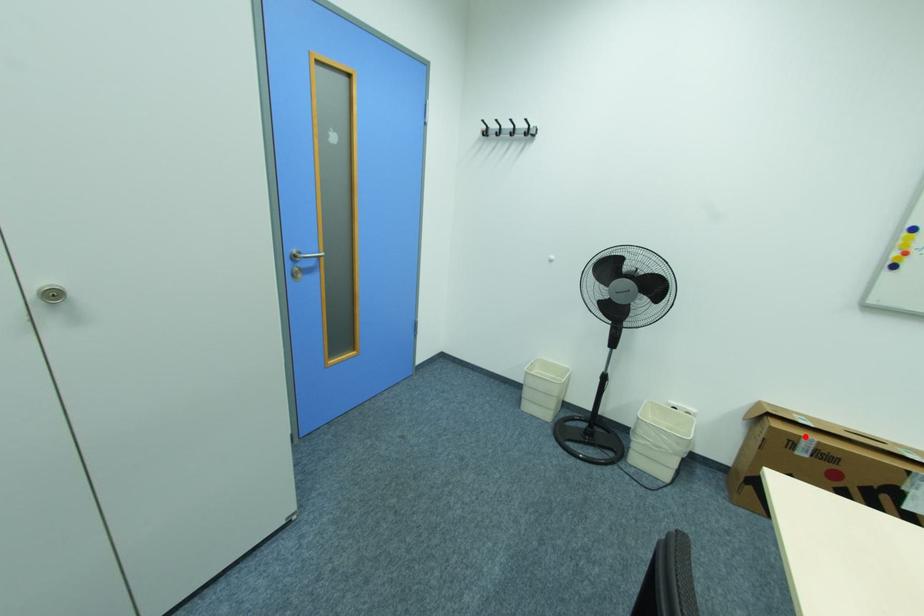
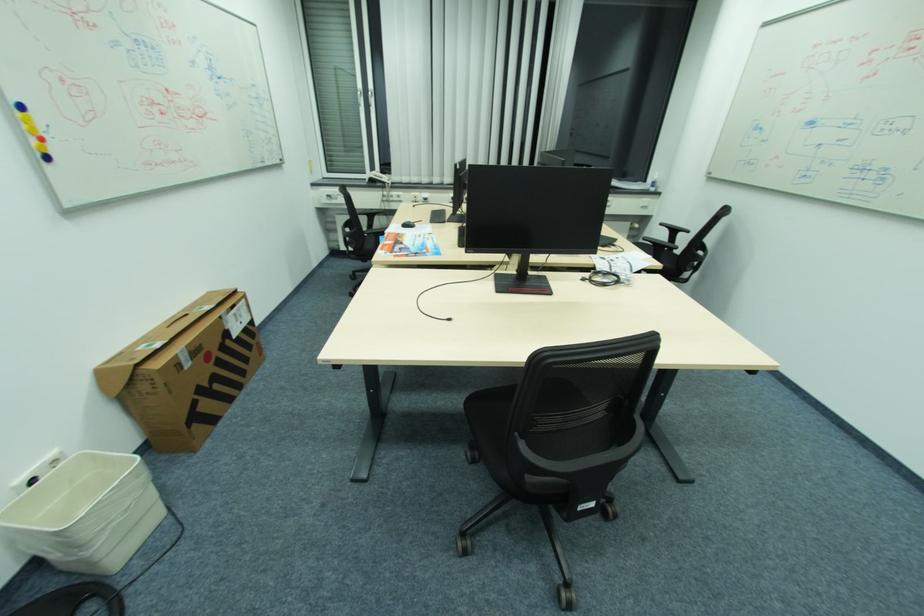
The point at the highlighted location is marked in the first image. Where is the corresponding point in the second image?

(181, 355)